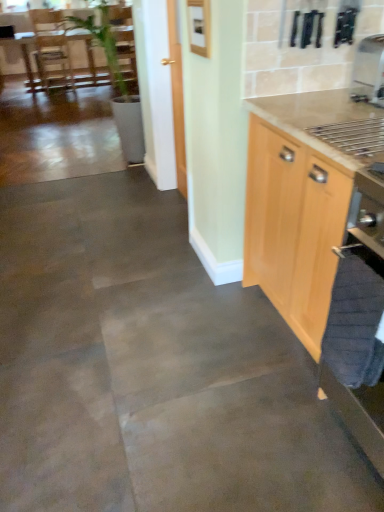
Question: Is light wood cabinet at right smaller than brown wooden table at upper left?

Choices:
 (A) no
 (B) yes

Answer: (B)

Question: Is light wood cabinet at right behind brown wooden table at upper left?

Choices:
 (A) yes
 (B) no

Answer: (B)

Question: Could you tell me if light wood cabinet at right is facing brown wooden table at upper left?

Choices:
 (A) yes
 (B) no

Answer: (B)

Question: Is light wood cabinet at right closer to camera compared to brown wooden table at upper left?

Choices:
 (A) no
 (B) yes

Answer: (B)

Question: Does light wood cabinet at right touch brown wooden table at upper left?

Choices:
 (A) yes
 (B) no

Answer: (B)

Question: Is light wood cabinet at right to the left of brown wooden table at upper left from the viewer's perspective?

Choices:
 (A) no
 (B) yes

Answer: (A)

Question: Is brown wooden table at upper left inside satin silver coffee machine at upper right?

Choices:
 (A) no
 (B) yes

Answer: (A)

Question: Is satin silver coffee machine at upper right bigger than brown wooden table at upper left?

Choices:
 (A) yes
 (B) no

Answer: (B)

Question: Considering the relative positions of satin silver coffee machine at upper right and brown wooden table at upper left in the image provided, is satin silver coffee machine at upper right in front of brown wooden table at upper left?

Choices:
 (A) yes
 (B) no

Answer: (A)

Question: Would you say satin silver coffee machine at upper right is a long distance from brown wooden table at upper left?

Choices:
 (A) no
 (B) yes

Answer: (B)

Question: Considering the relative positions of satin silver coffee machine at upper right and brown wooden table at upper left in the image provided, is satin silver coffee machine at upper right to the left of brown wooden table at upper left from the viewer's perspective?

Choices:
 (A) yes
 (B) no

Answer: (B)

Question: Is satin silver coffee machine at upper right outside of brown wooden table at upper left?

Choices:
 (A) no
 (B) yes

Answer: (B)

Question: Considering the relative sizes of brown wooden table at upper left and satin silver coffee machine at upper right in the image provided, is brown wooden table at upper left thinner than satin silver coffee machine at upper right?

Choices:
 (A) no
 (B) yes

Answer: (A)